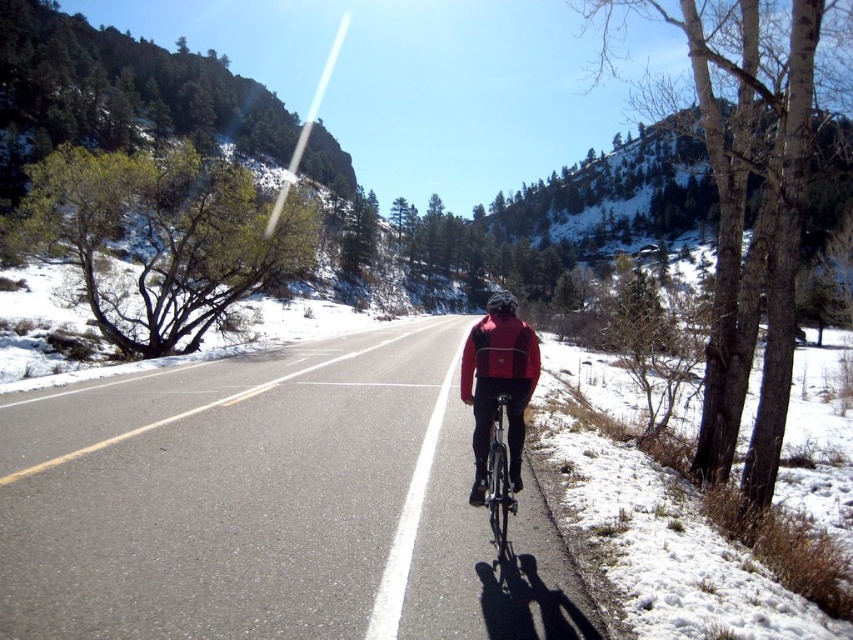
You are a photographer standing at the edge of the road. You want to take a photo of the cyclist wearing the matte red jacket at center and their shiny metallic bicycle at center. Based on their heights, which object should you focus on first if you want to ensure both are in focus without adjusting your camera settings?

The matte red jacket at center is taller than the shiny metallic bicycle at center. Since the camera focuses on the nearest subject, you should focus on the shiny metallic bicycle at center first to ensure both are in focus.

You are a drone operator trying to capture a photo of the cyclist wearing the red matte jacket at center. The drone is currently hovering at point coordinates of 0.5, 0.5. To get the best shot, you need to adjust the drone to the exact position of the cyclist. Which direction should you move the drone to reach the cyclist?

The red matte jacket at center is located at point (498, 388). Since the drone is at (426, 320), you should move it northeast to reach the cyclist.

You are a photographer aiming to capture the cyclist and their bicycle in the snowy landscape. You want to ensure the matte red jacket at center and the shiny metallic bicycle at center are both clearly visible in your shot. Based on their positions, which object is closer to the right edge of the photo?

The matte red jacket at center is to the right of the shiny metallic bicycle at center, so the matte red jacket at center is closer to the right edge of the photo.